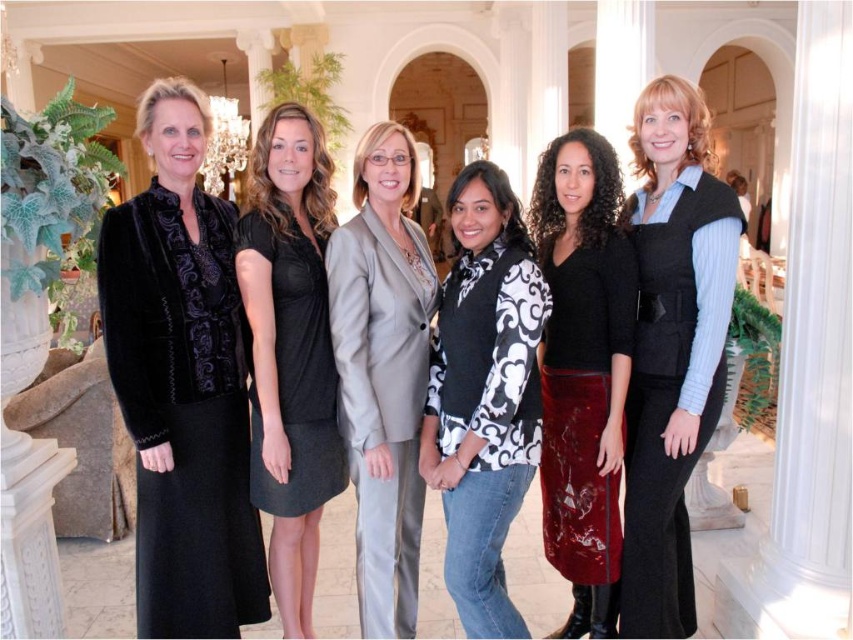
Question: Estimate the real-world distances between objects in this image. Which object is farther from the velvet black vest at center?

Choices:
 (A) black and white patterned top at center
 (B) black dress at center
 (C) light gray satin blazer at center
 (D) velvet skirt at center

Answer: (B)

Question: Which of the following is the closest to the observer?

Choices:
 (A) (616, 532)
 (B) (144, 520)
 (C) (730, 259)

Answer: (C)

Question: Considering the relative positions of velvet black dress at left and velvet skirt at center in the image provided, where is velvet black dress at left located with respect to velvet skirt at center?

Choices:
 (A) below
 (B) above

Answer: (B)

Question: Can you confirm if velvet black vest at center is positioned to the right of black and white patterned top at center?

Choices:
 (A) yes
 (B) no

Answer: (A)

Question: Is velvet black dress at left bigger than velvet black vest at center?

Choices:
 (A) yes
 (B) no

Answer: (B)

Question: Which point is closer to the camera?

Choices:
 (A) velvet black dress at left
 (B) velvet black vest at center

Answer: (A)